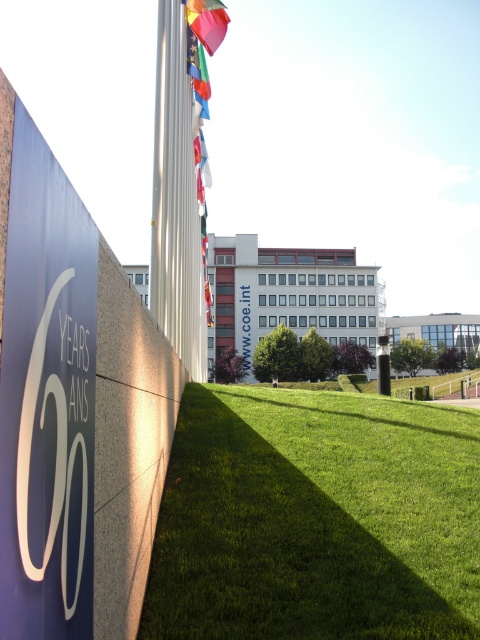
Question: Is green grass at lower center below white glossy logo at lower left?

Choices:
 (A) no
 (B) yes

Answer: (B)

Question: Which point is closer to the camera?

Choices:
 (A) (365, 413)
 (B) (24, 422)

Answer: (B)

Question: Is white glossy logo at lower left thinner than silky fabric flag at upper center?

Choices:
 (A) no
 (B) yes

Answer: (B)

Question: Which of the following is the closest to the observer?

Choices:
 (A) green grass at lower center
 (B) silky fabric flag at upper center

Answer: (A)

Question: Is green grass at lower center wider than silky fabric flag at upper center?

Choices:
 (A) yes
 (B) no

Answer: (A)

Question: Based on their relative distances, which object is nearer to the green grass at lower center?

Choices:
 (A) white glossy logo at lower left
 (B) silky fabric flag at upper center

Answer: (A)